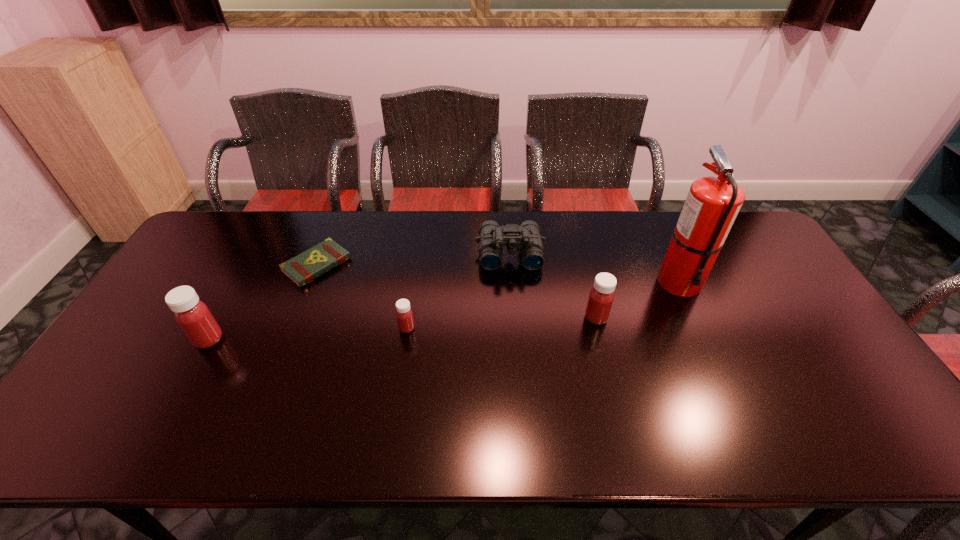
Locate an element on the screen. the leftmost object is located at coordinates (193, 316).

Where is `the second shortest object`? The width and height of the screenshot is (960, 540). the second shortest object is located at coordinates (404, 314).

Where is `the shortest medicine`? Image resolution: width=960 pixels, height=540 pixels. the shortest medicine is located at coordinates tap(404, 314).

The width and height of the screenshot is (960, 540). Find the location of `the second tallest medicine`. the second tallest medicine is located at coordinates (601, 296).

Find the location of a particular element. This screenshot has width=960, height=540. the rightmost medicine is located at coordinates (601, 296).

I want to click on book, so click(x=302, y=269).

Image resolution: width=960 pixels, height=540 pixels. What are the coordinates of `the shortest object` in the screenshot? It's located at (302, 269).

At what (x,y) coordinates should I click in order to perform the action: click on the third object from right to left. Please return your answer as a coordinate pair (x, y). Looking at the image, I should click on (527, 236).

Find the location of a particular element. This screenshot has width=960, height=540. the fourth tallest object is located at coordinates (527, 236).

Locate an element on the screen. Image resolution: width=960 pixels, height=540 pixels. the rightmost object is located at coordinates (713, 203).